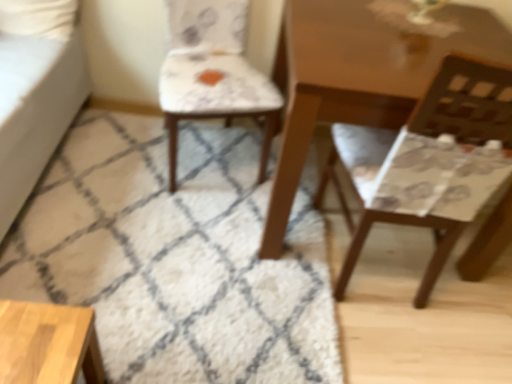
Find the location of a particular element. Image resolution: width=512 pixels, height=384 pixels. free space in front of matte brown chair at right, the 2th chair when ordered from left to right is located at coordinates (409, 346).